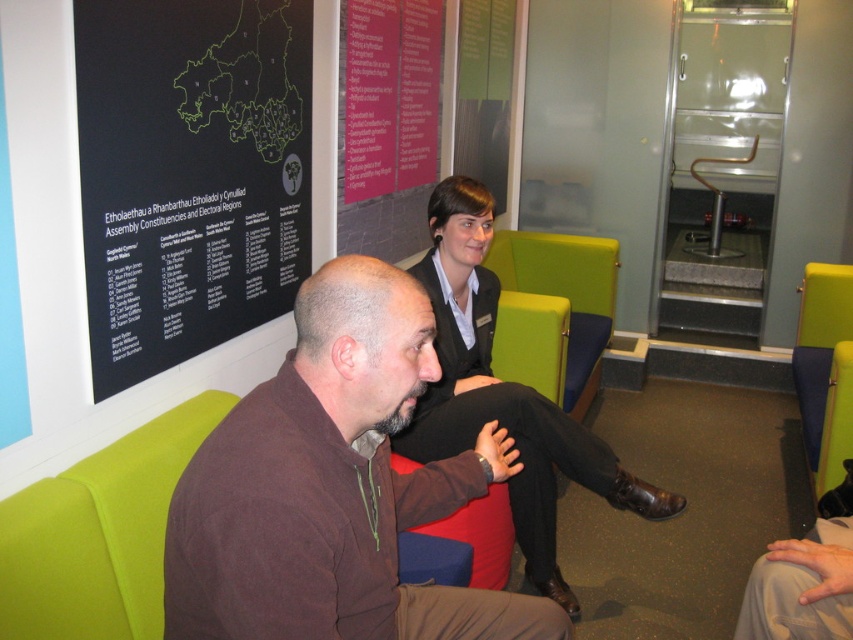
You are a security guard standing at the entrance of the waiting area. There is a matte black blazer at center that you need to inspect. Can you reach it without moving from your current position?

The matte black blazer at center and viewer are 7.44 feet apart, so yes, you can reach it without moving from your current position as the distance is manageable.